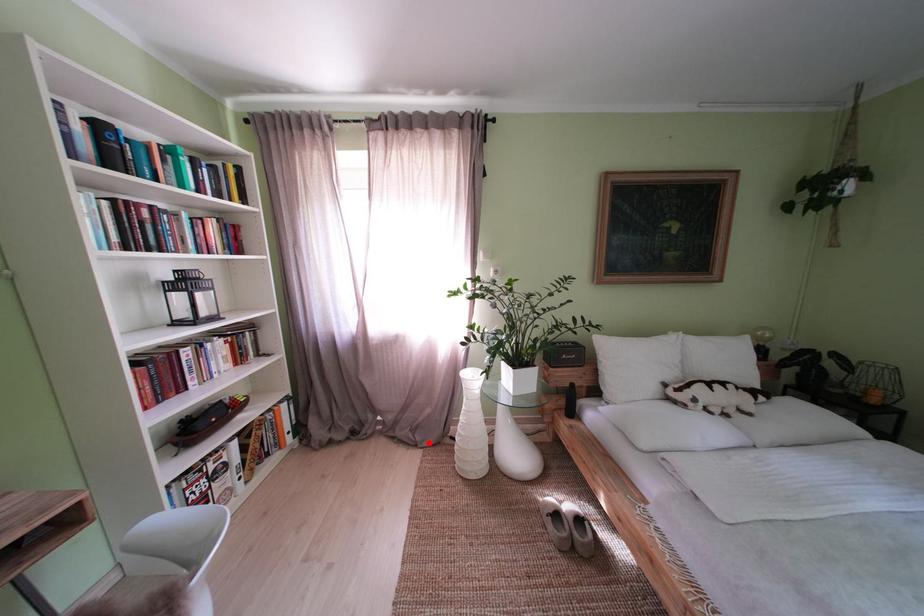
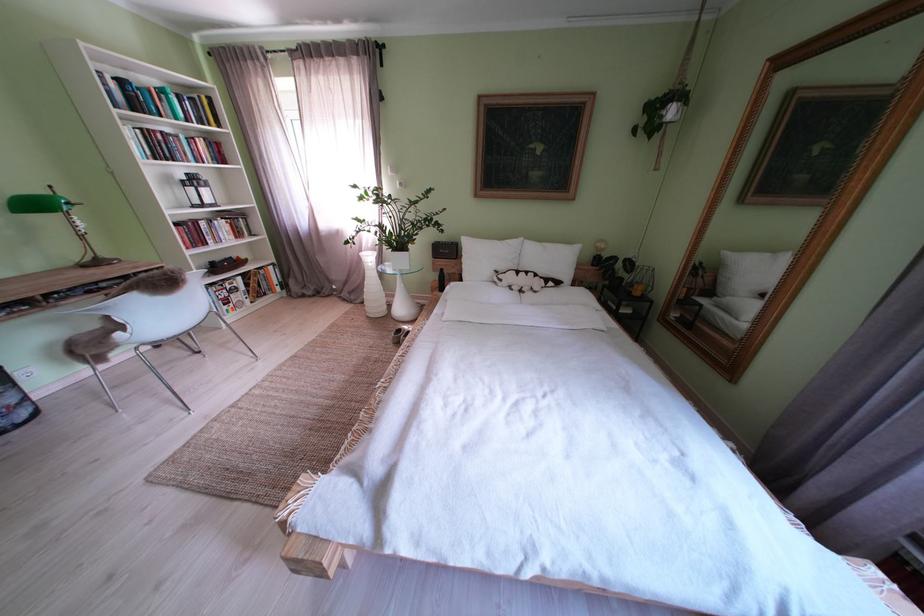
Question: A red point is marked in image1. In image2, is the corresponding 3D point closer to the camera or farther? Reply with the corresponding letter.

Choices:
 (A) The corresponding 3D point is closer.
 (B) The corresponding 3D point is farther.

Answer: (A)